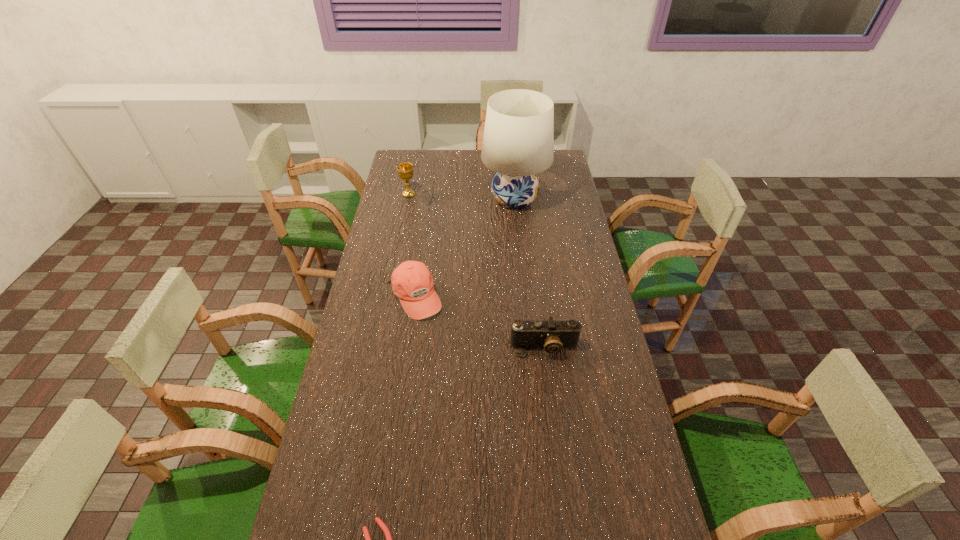
Identify the location of chalice that is at the left edge. This screenshot has height=540, width=960. (405, 170).

I want to click on baseball cap that is at the left edge, so click(x=412, y=282).

Image resolution: width=960 pixels, height=540 pixels. I want to click on lampshade that is at the right edge, so click(518, 143).

You are a GUI agent. You are given a task and a screenshot of the screen. Output one action in this format:
    pyautogui.click(x=<x>, y=<y>)
    Task: Click on the camera that is at the right edge
    This screenshot has height=540, width=960.
    Given the screenshot: What is the action you would take?
    pyautogui.click(x=551, y=335)

Where is `free space at the far edge of the desktop`? free space at the far edge of the desktop is located at coordinates (472, 154).

Image resolution: width=960 pixels, height=540 pixels. In the image, there is a desktop. Find the location of `vacant area at the left edge`. vacant area at the left edge is located at coordinates pos(393,205).

Locate an element on the screen. The height and width of the screenshot is (540, 960). vacant space at the right edge of the desktop is located at coordinates (609, 508).

You are a GUI agent. You are given a task and a screenshot of the screen. Output one action in this format:
    pyautogui.click(x=<x>, y=<y>)
    Task: Click on the vacant space at the far left corner of the desktop
    Image resolution: width=960 pixels, height=540 pixels.
    Given the screenshot: What is the action you would take?
    pyautogui.click(x=404, y=152)

This screenshot has height=540, width=960. I want to click on empty location between the third nearest object and the chalice, so click(412, 246).

The image size is (960, 540). I want to click on vacant area that lies between the tallest object and the chalice, so click(462, 197).